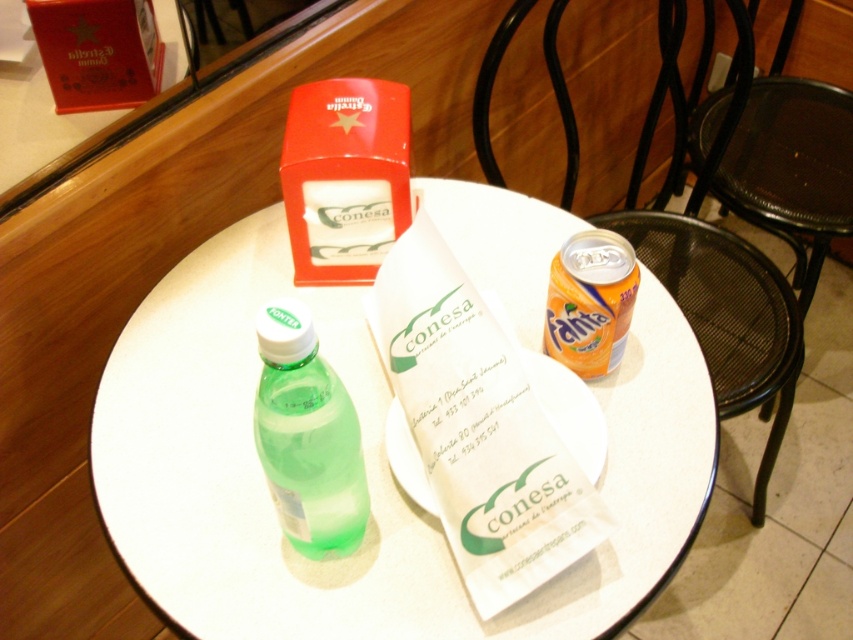
Question: Is white paper menu at center bigger than green translucent bottle at center?

Choices:
 (A) no
 (B) yes

Answer: (B)

Question: Is transparent plastic bottle at center to the left of orange matte can at upper right from the viewer's perspective?

Choices:
 (A) no
 (B) yes

Answer: (B)

Question: Which point appears closest to the camera in this image?

Choices:
 (A) (352, 124)
 (B) (315, 513)

Answer: (B)

Question: Considering the real-world distances, which object is farthest from the red plastic napkin dispenser at upper center?

Choices:
 (A) transparent plastic bottle at center
 (B) orange matte can at upper right
 (C) white paper menu at center

Answer: (B)

Question: Which object is positioned farthest from the red plastic napkin dispenser at upper center?

Choices:
 (A) green translucent bottle at center
 (B) black mesh chair at right

Answer: (B)

Question: Can you confirm if black mesh chair at right is thinner than red plastic napkin dispenser at upper center?

Choices:
 (A) yes
 (B) no

Answer: (B)